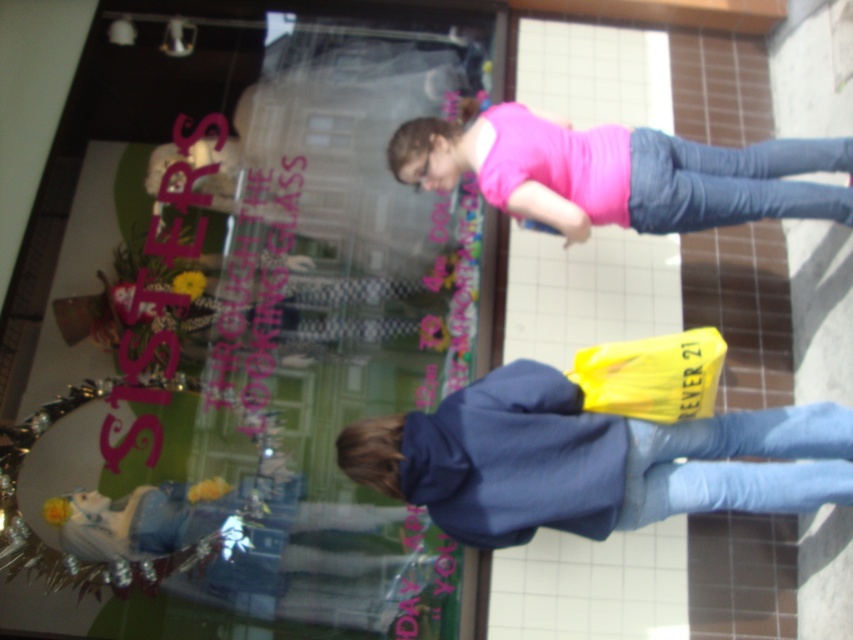
Question: Is blue denim jacket at lower right to the right of pink matte shirt at center from the viewer's perspective?

Choices:
 (A) yes
 (B) no

Answer: (B)

Question: Which of the following is the farthest from the observer?

Choices:
 (A) pink matte shirt at center
 (B) transparent glass at upper center
 (C) denim jeans at center

Answer: (B)

Question: Which object appears closest to the camera in this image?

Choices:
 (A) denim jeans at center
 (B) blue denim jacket at lower right
 (C) transparent glass at upper center

Answer: (B)

Question: Does blue denim jacket at lower right have a lesser width compared to pink matte shirt at center?

Choices:
 (A) no
 (B) yes

Answer: (A)

Question: Is transparent glass at upper center positioned behind blue denim jacket at lower right?

Choices:
 (A) yes
 (B) no

Answer: (A)

Question: Which point is farther to the camera?

Choices:
 (A) (836, 196)
 (B) (838, 163)

Answer: (B)